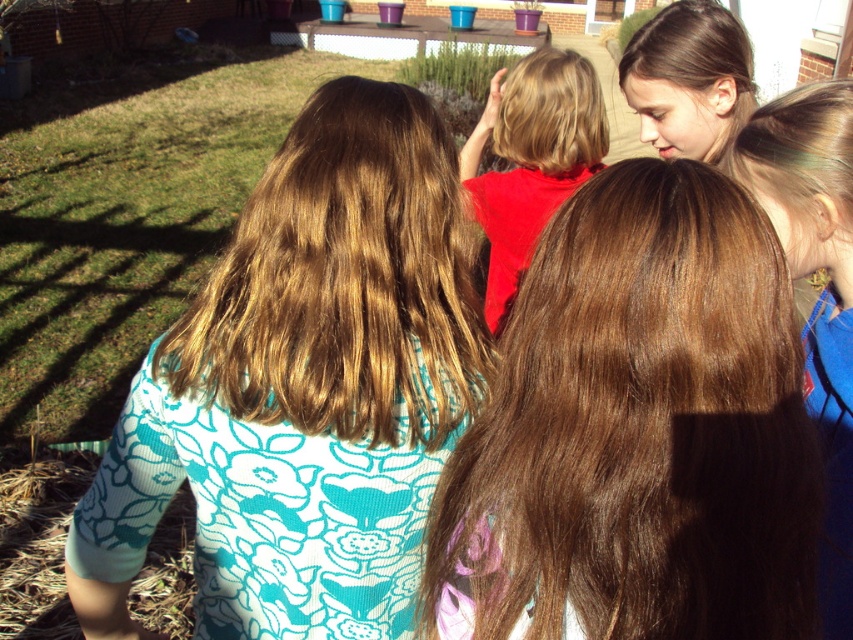
You are a photographer trying to capture a closeup shot of the brown silky hair at center. Your camera has a minimum focusing distance of 25 inches. Can you take the photo without moving the camera?

The brown silky hair at center and camera are 27.13 inches apart, so yes, the photographer can take the photo without moving the camera since the distance is within the minimum focusing distance of 25 inches.

You are standing in a garden and see the brown hair at upper right. If you want to reach it in 2 steps, each step being 50 centimeters, will you be able to reach it?

The brown hair at upper right is 73.13 centimeters away from the viewer. Taking two steps of 50 centimeters each would cover 100 centimeters, which is more than enough to reach it. Therefore, you can reach it in two steps.